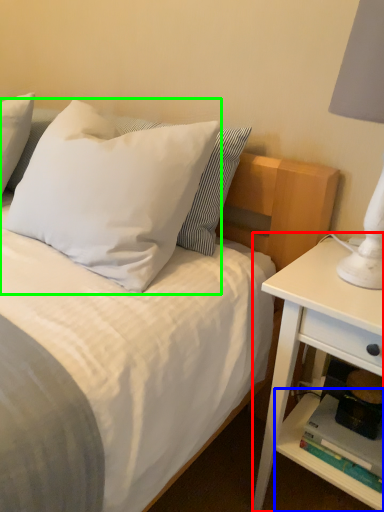
Question: Which is farther away from nightstand (highlighted by a red box)? shelf (highlighted by a blue box) or pillow (highlighted by a green box)?

Choices:
 (A) shelf
 (B) pillow

Answer: (B)